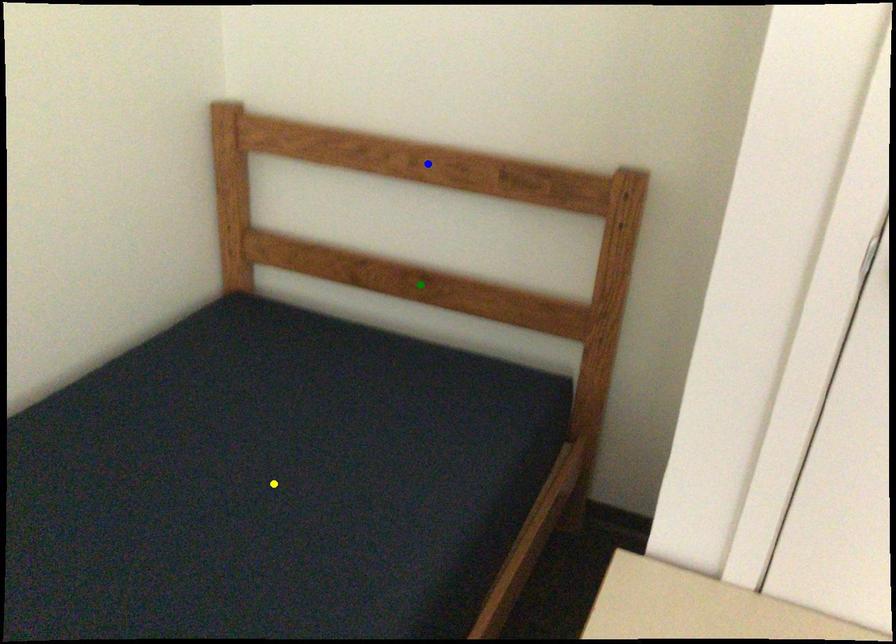
Order these from nearest to farthest:
A) yellow point
B) blue point
C) green point

yellow point, blue point, green point